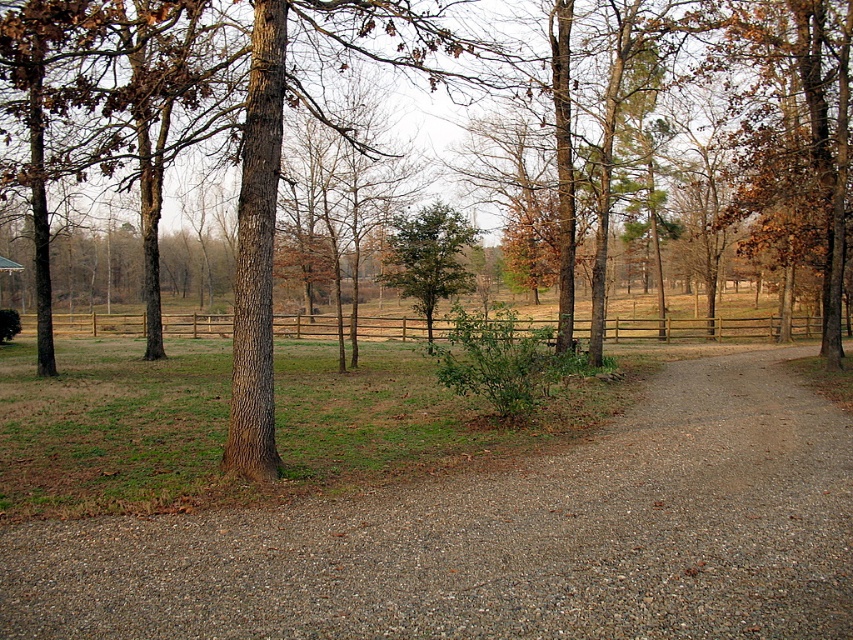
Describe the element at coordinates (691, 328) in the screenshot. I see `brown wooden fence at center` at that location.

Who is taller, brown wooden fence at center or green leafy tree at center?

Standing taller between the two is brown wooden fence at center.

Does point (126, 323) come farther from viewer compared to point (427, 321)?

Yes, point (126, 323) is farther from viewer.

I want to click on brown wooden fence at center, so click(691, 328).

Can you confirm if brown gravel path at center is positioned above green leafy tree at center?

No.

Based on the photo, does brown gravel path at center have a smaller size compared to green leafy tree at center?

No, brown gravel path at center is not smaller than green leafy tree at center.

Where is `brown gravel path at center`? This screenshot has width=853, height=640. brown gravel path at center is located at coordinates (502, 538).

Who is shorter, brown gravel path at center or brown wooden fence at center?

brown gravel path at center

Between brown gravel path at center and brown wooden fence at center, which one appears on the left side from the viewer's perspective?

brown wooden fence at center is more to the left.

Is point (447, 604) behind point (776, 317)?

No, it is in front of (776, 317).

At what (x,y) coordinates should I click in order to perform the action: click on brown gravel path at center. Please return your answer as a coordinate pair (x, y). This screenshot has height=640, width=853. Looking at the image, I should click on (502, 538).